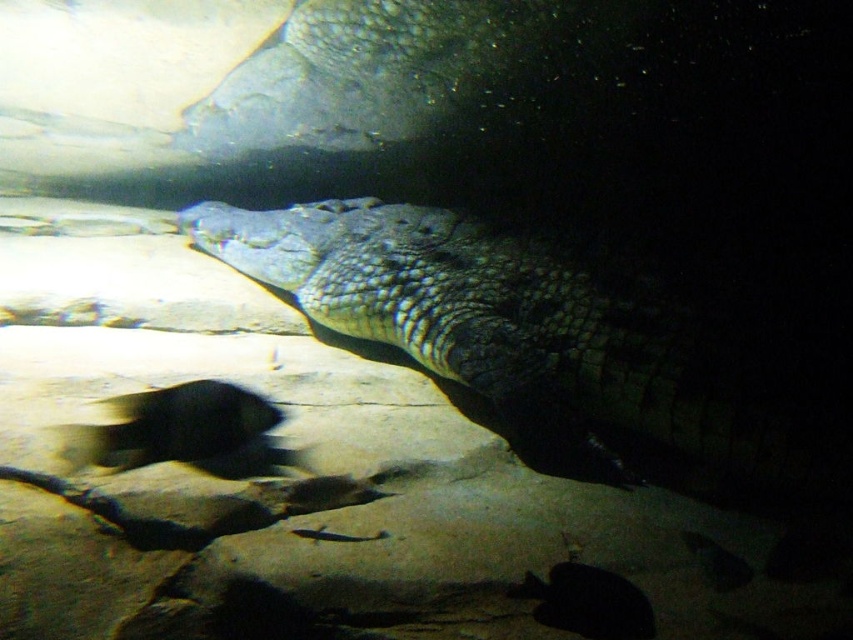
Does scaly greenish-brown crocodile at center appear over black glossy fish at lower left?

Correct, scaly greenish-brown crocodile at center is located above black glossy fish at lower left.

Is scaly greenish-brown crocodile at center to the right of black glossy fish at lower left from the viewer's perspective?

Yes, scaly greenish-brown crocodile at center is to the right of black glossy fish at lower left.

Is point (263, 282) closer to camera compared to point (161, 401)?

No.

Locate an element on the screen. scaly greenish-brown crocodile at center is located at coordinates (538, 342).